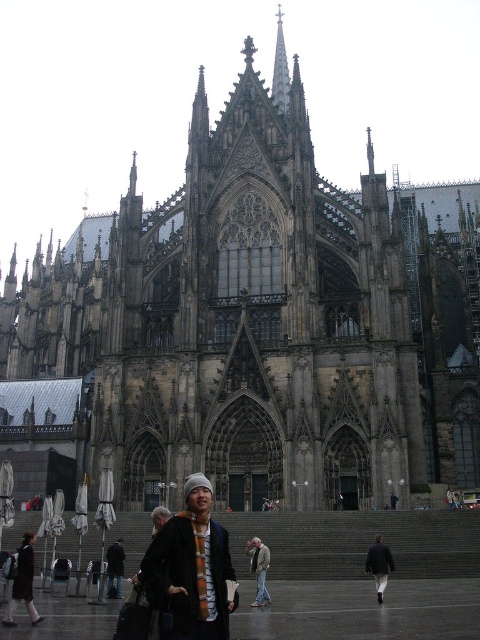
You are standing in front of the grand Gothic cathedral and want to find the orange scarf at lower left. Based on the coordinates provided, where exactly should you look to locate it?

The orange scarf at lower left is located at point coordinates of (23, 582), so you should look towards the lower left area near those coordinates to find it.

You are a photographer standing at the base of the cathedral, trying to capture both the orange scarf at lower left and the orange scarf at center in a single photo. Given that your camera has a maximum zoom range of 10 meters, can you fit both objects into the frame?

The orange scarf at lower left and orange scarf at center are 8.34 meters apart. Since the camera has a maximum zoom range of 10 meters, which is greater than the distance between them, you can fit both objects into the frame.

You are a fashion designer observing the cathedral plaza. You notice two garments in the scene. Which garment has a larger size between the dark gray wool coat at lower right and the light gray jacket at center?

The dark gray wool coat at lower right is bigger than the light gray jacket at center.